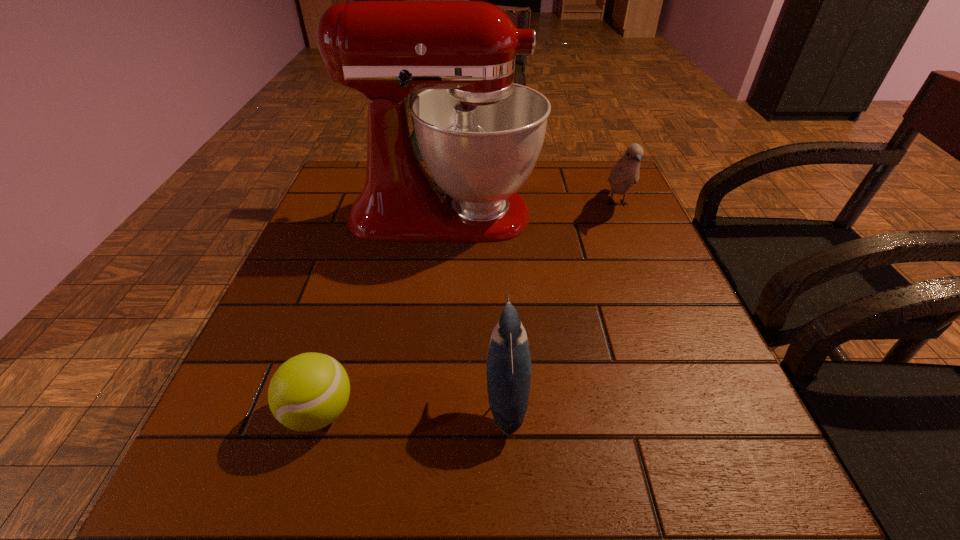
Find the location of a particular element. This screenshot has width=960, height=540. free point between the rightmost object and the mixer is located at coordinates (531, 209).

Where is `free spot between the rightmost object and the left bird`? The image size is (960, 540). free spot between the rightmost object and the left bird is located at coordinates (562, 301).

Find the location of a particular element. free spot between the left bird and the tennis ball is located at coordinates (413, 405).

This screenshot has width=960, height=540. I want to click on object identified as the third closest to the farther bird, so click(x=309, y=391).

Identify the location of object identified as the second closest to the nearer bird. Image resolution: width=960 pixels, height=540 pixels. (480, 134).

Find the location of a particular element. The height and width of the screenshot is (540, 960). free space in the image that satisfies the following two spatial constraints: 1. at the beak of the rightmost object; 2. at the attachment hub of the mixer is located at coordinates (621, 214).

The image size is (960, 540). I want to click on free region that satisfies the following two spatial constraints: 1. at the beak of the farther bird; 2. at the tip of the nearer bird's beak, so click(x=699, y=398).

Find the location of `free space that satisfies the following two spatial constraints: 1. at the beak of the right bird; 2. at the tip of the nearer bird's beak`. free space that satisfies the following two spatial constraints: 1. at the beak of the right bird; 2. at the tip of the nearer bird's beak is located at coordinates (699, 398).

Where is `free space in the image that satisfies the following two spatial constraints: 1. at the beak of the rightmost object; 2. at the tip of the left bird's beak`? free space in the image that satisfies the following two spatial constraints: 1. at the beak of the rightmost object; 2. at the tip of the left bird's beak is located at coordinates (699, 398).

You are a GUI agent. You are given a task and a screenshot of the screen. Output one action in this format:
    pyautogui.click(x=<x>, y=<y>)
    Task: Click on the vacant space that satisfies the following two spatial constraints: 1. at the beak of the rightmost object; 2. at the attachment hub of the tallest object
    This screenshot has width=960, height=540.
    Given the screenshot: What is the action you would take?
    pyautogui.click(x=621, y=214)